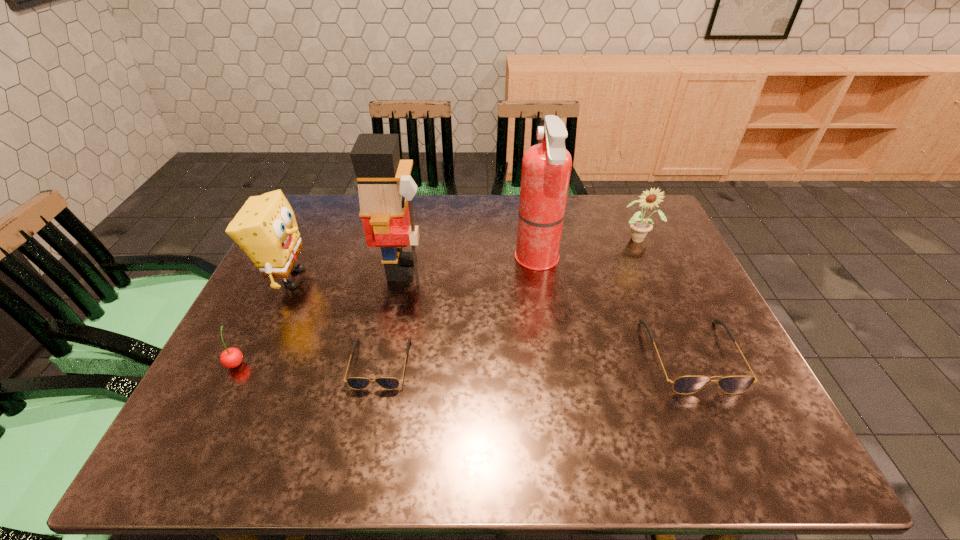
Image resolution: width=960 pixels, height=540 pixels. Find the location of `vacant region located 0.330m with the handle and hose on the fire extinguisher`. vacant region located 0.330m with the handle and hose on the fire extinguisher is located at coordinates (398, 260).

You are a GUI agent. You are given a task and a screenshot of the screen. Output one action in this format:
    pyautogui.click(x=<x>, y=<y>)
    Task: Click on the vacant space situated with the handle and hose on the fire extinguisher
    This screenshot has width=960, height=540.
    Given the screenshot: What is the action you would take?
    pyautogui.click(x=427, y=260)

The height and width of the screenshot is (540, 960). Find the location of `free space located 0.330m on the face of the sponge`. free space located 0.330m on the face of the sponge is located at coordinates (436, 278).

Find the location of a particular element. Image resolution: width=960 pixels, height=540 pixels. vacant space located 0.220m on the front-facing side of the fourth shortest object is located at coordinates pyautogui.click(x=666, y=300).

Where is `free region located in front of the nutcracker holding the staff`? free region located in front of the nutcracker holding the staff is located at coordinates (458, 269).

You are a GUI agent. You are given a task and a screenshot of the screen. Output one action in this format:
    pyautogui.click(x=<x>, y=<y>)
    Task: Click on the free space located on the right of the cherry
    This screenshot has width=960, height=540.
    Given the screenshot: What is the action you would take?
    pyautogui.click(x=282, y=362)

This screenshot has width=960, height=540. I want to click on fire extinguisher that is at the far edge, so click(x=546, y=167).

At what (x,y) coordinates should I click in order to perform the action: click on sunflower positioned at the far edge. Please return your answer as a coordinate pair (x, y). The image size is (960, 540). Looking at the image, I should click on (640, 227).

Identify the location of sponge that is at the left edge. (265, 228).

Locate an element on the screen. This screenshot has height=540, width=960. cherry that is positioned at the left edge is located at coordinates (231, 357).